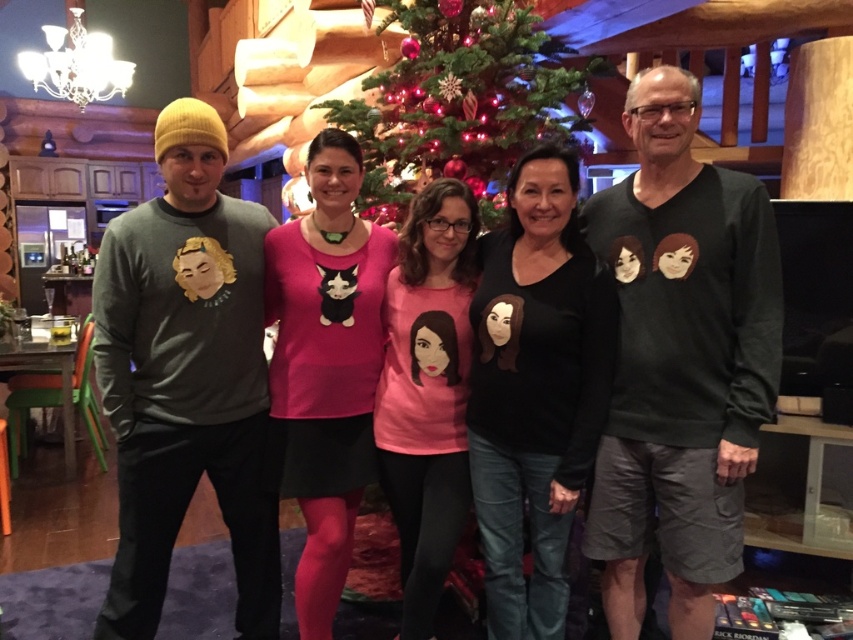
You are planning to take a photo with the group in the scene. The photographer wants to ensure that the green matte christmas tree at center and the pink matte shirt at center are both visible in the frame. Considering their sizes, which object should be placed closer to the camera to ensure both fit in the photo?

The green matte christmas tree at center is wider than the pink matte shirt at center. To ensure both fit in the photo, the photographer should place the wider object, the green matte christmas tree at center, closer to the camera. This way, its larger size can be accommodated without overcrowding the frame.

You are standing in the room where the group is posing for the photo. Where is the green matte christmas tree at center located in relation to your position?

The green matte christmas tree at center is located at point 0.153 on the x axis and 0.544 on the y axis relative to your position.